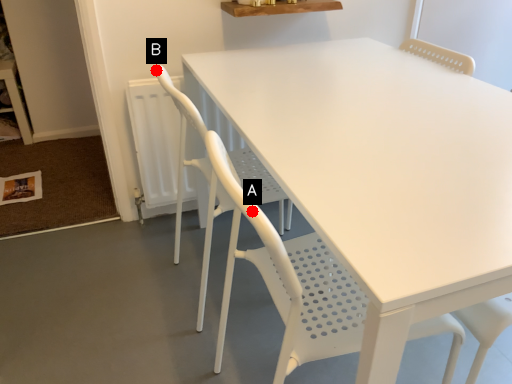
Question: Two points are circled on the image, labeled by A and B beside each circle. Among these points, which one is farthest from the camera?

Choices:
 (A) A is further
 (B) B is further

Answer: (B)